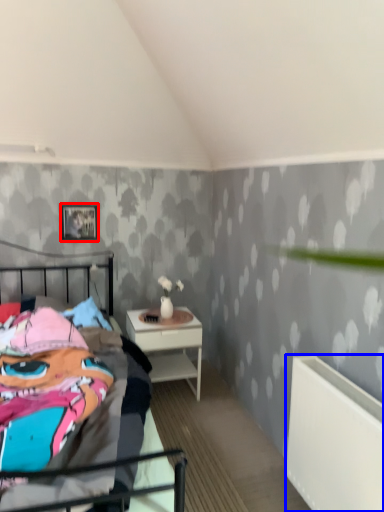
Question: Which of the following is the closest to the observer, picture frame (highlighted by a red box) or radiator (highlighted by a blue box)?

Choices:
 (A) picture frame
 (B) radiator

Answer: (B)